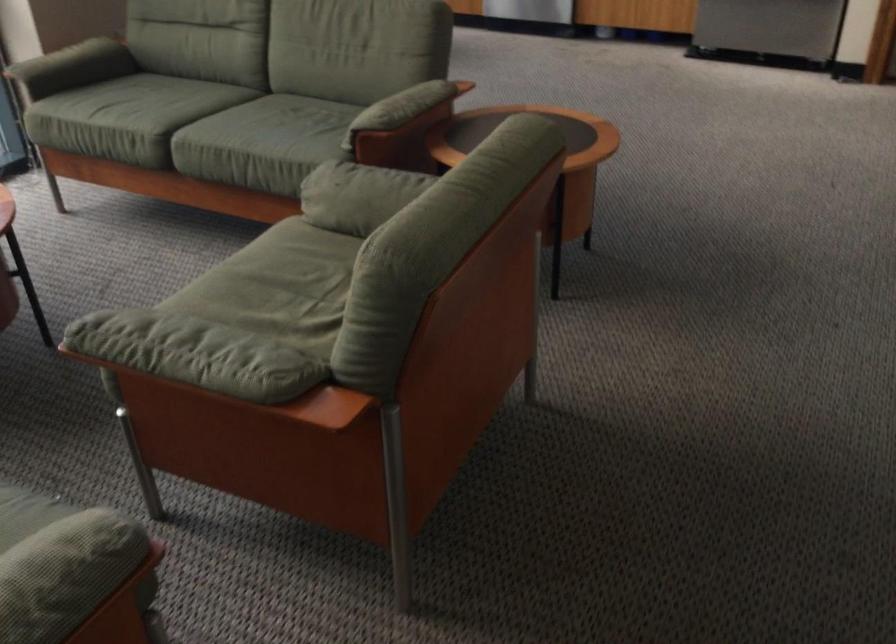
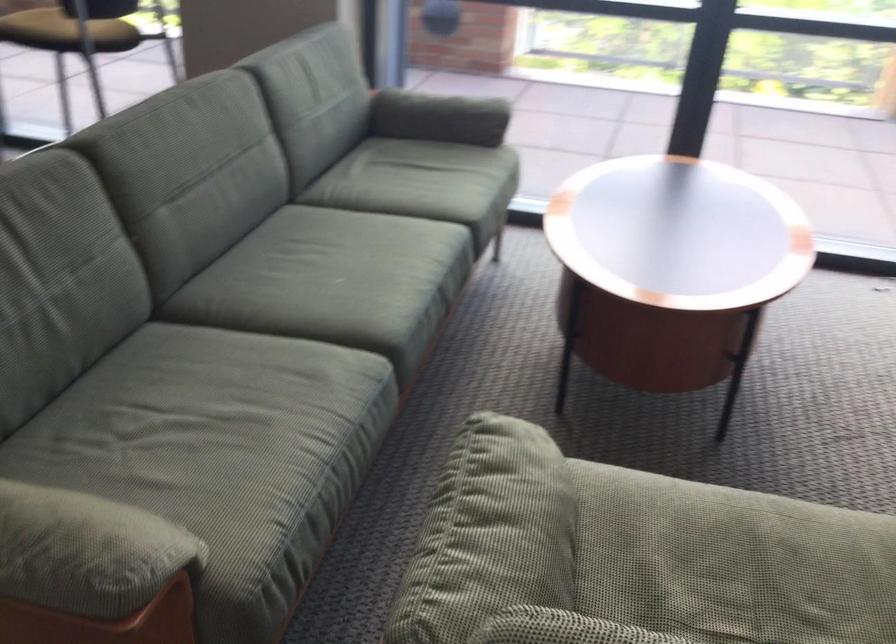
Find the pixel in the second image that matches point (83, 547) in the first image.

(82, 552)